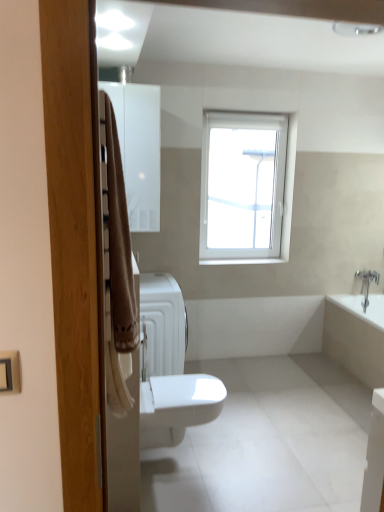
Locate an element on the screen. vacant space underneath white glossy bidet at center (from a real-world perspective) is located at coordinates (185, 454).